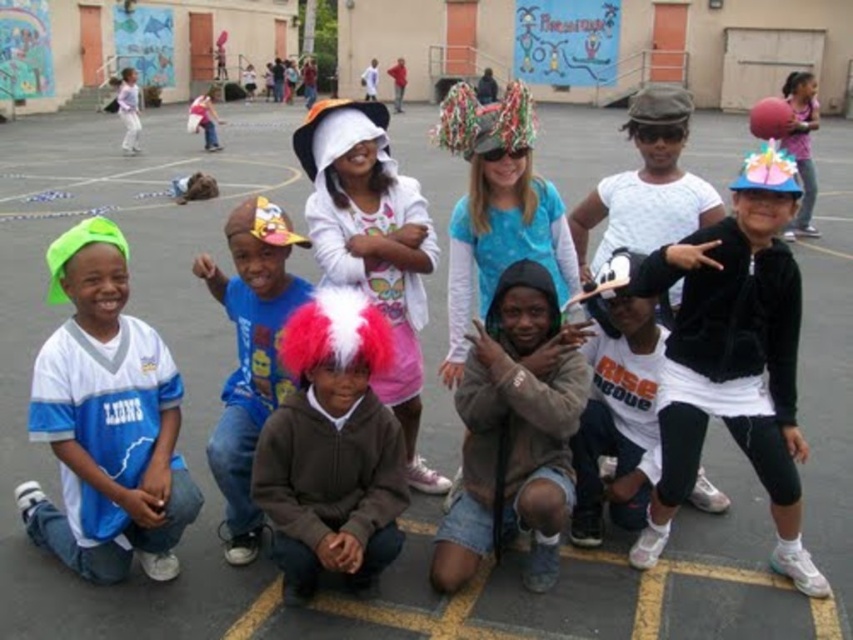
You are a photographer trying to capture a clear shot of the shiny black jacket at center right and the matte pink shirt at upper right. However, you notice that one of the objects is blocking the other. Which object is closer to the camera, and which one is being blocked?

The shiny black jacket at center right is in front of the matte pink shirt at upper right, so the shiny black jacket is closer to the camera and blocking the matte pink shirt.

You are observing the children in the playground scene. Which child is wearing a taller garment between the shiny black jacket at center right and the blue cotton shirt at center?

The shiny black jacket at center right is taller than the blue cotton shirt at center.